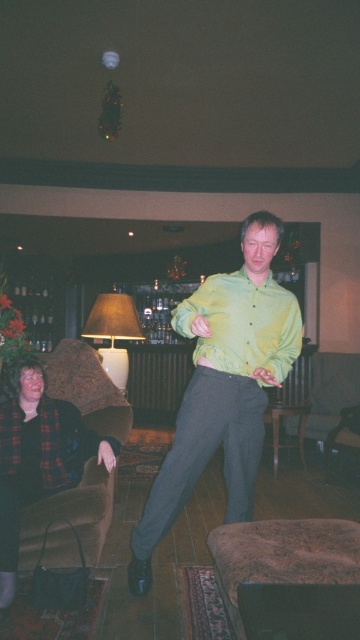
You are planning to place a new coffee table in the living room. The velvet brown couch at lower left and the green shiny shirt at center are in the way. Which object should you move first to create space for the coffee table?

The velvet brown couch at lower left is located below the green shiny shirt at center, so you should move the velvet brown couch at lower left first to create space for the coffee table.